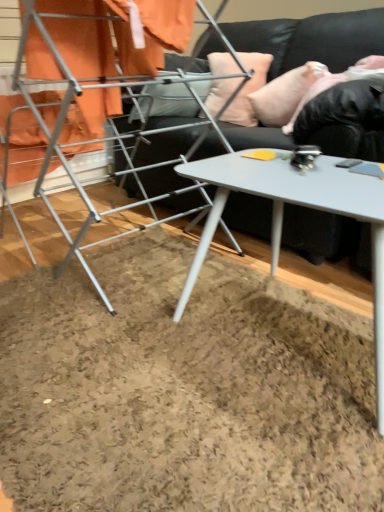
Question: Is white glossy table at center spatially inside peach fabric pillow at upper center, which is the 1th pillow from left to right, or outside of it?

Choices:
 (A) outside
 (B) inside

Answer: (A)

Question: From a real-world perspective, is white glossy table at center above or below peach fabric pillow at upper center, the 2th pillow from the right?

Choices:
 (A) above
 (B) below

Answer: (B)

Question: Which object is positioned closest to the pink fabric pillow at upper right, marked as the 1th pillow in a right-to-left arrangement?

Choices:
 (A) metallic silver drying rack at left
 (B) white glossy table at center
 (C) peach fabric pillow at upper center, which is the 1th pillow from left to right
 (D) black leather couch at upper center
 (E) black soft fur at upper right

Answer: (E)

Question: Which object is positioned closest to the white glossy table at center?

Choices:
 (A) black soft fur at upper right
 (B) pink fabric pillow at upper right, placed as the 2th pillow when sorted from left to right
 (C) peach fabric pillow at upper center, the 2th pillow from the right
 (D) black leather couch at upper center
 (E) metallic silver drying rack at left

Answer: (D)